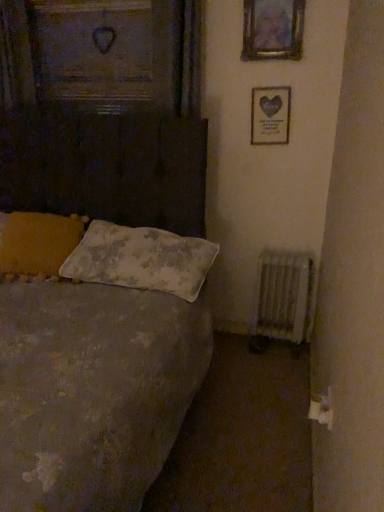
Question: From a real-world perspective, relative to white textured radiator at lower right, is matte silver picture frame at upper right, the 2th picture frame in the front-to-back sequence, vertically above or below?

Choices:
 (A) below
 (B) above

Answer: (B)

Question: From the image's perspective, relative to white textured radiator at lower right, is matte silver picture frame at upper right, the 2th picture frame in the front-to-back sequence, above or below?

Choices:
 (A) below
 (B) above

Answer: (B)

Question: Which is nearer to the white textured radiator at lower right?

Choices:
 (A) fluffy white pillow at left, which is the 1th pillow in left-to-right order
 (B) textured gray bed at left
 (C) matte silver picture frame at upper right, which is counted as the second picture frame, starting from the top
 (D) white textured pillow at center, arranged as the 1th pillow when viewed from the right
 (E) metallic silver picture frame at upper center, arranged as the second picture frame when ordered from the bottom

Answer: (D)

Question: Which object is positioned farthest from the white textured radiator at lower right?

Choices:
 (A) textured gray bed at left
 (B) metallic silver picture frame at upper center, arranged as the second picture frame when ordered from the bottom
 (C) matte silver picture frame at upper right, which is counted as the first picture frame, starting from the bottom
 (D) white textured pillow at center, arranged as the 1th pillow when viewed from the right
 (E) fluffy white pillow at left, which is the 1th pillow in left-to-right order

Answer: (B)